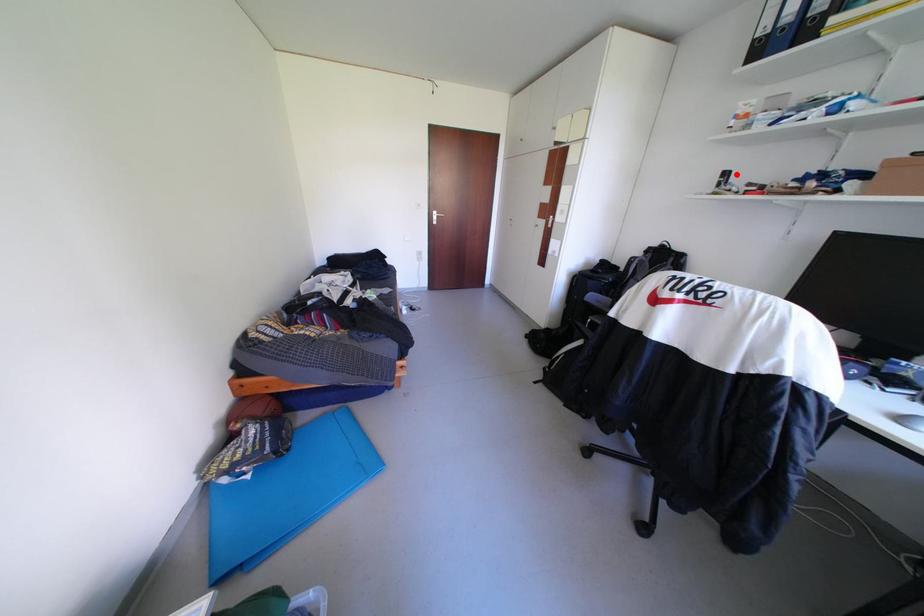
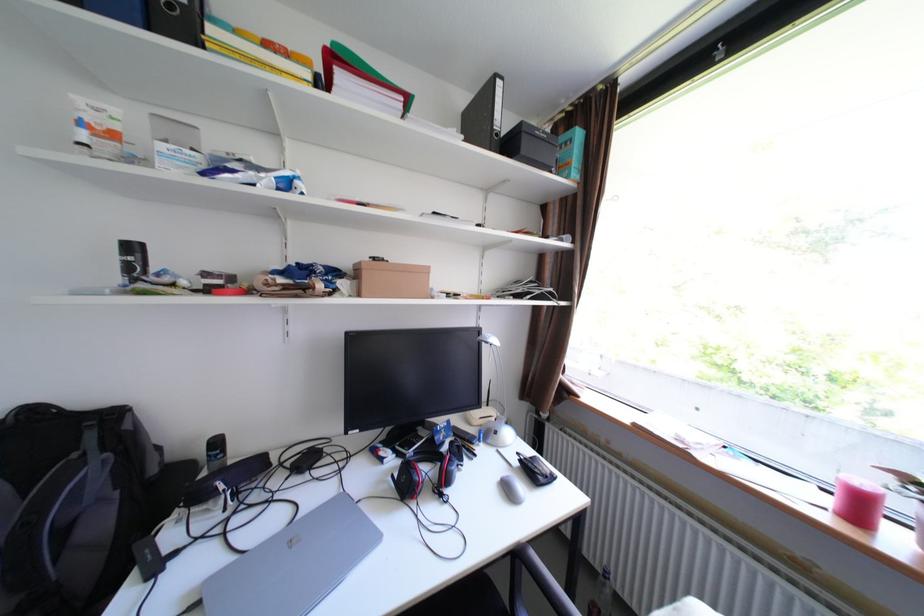
Locate, in the second image, the point that corresponds to the highlighted location in the first image.

(143, 248)